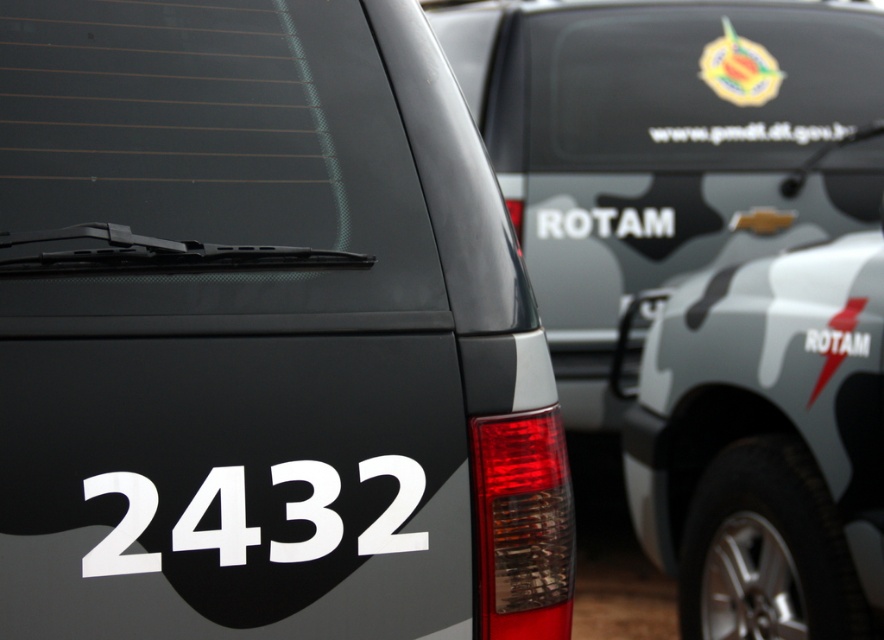
Question: Which point is farther to the camera?

Choices:
 (A) metallic emblem at upper right
 (B) white matte license plate at center

Answer: (A)

Question: Is matte black vehicle at center closer to the viewer compared to white matte text at center?

Choices:
 (A) yes
 (B) no

Answer: (A)

Question: Which point appears closest to the camera in this image?

Choices:
 (A) (215, 108)
 (B) (785, 125)
 (C) (751, 52)
 (D) (630, 307)

Answer: (A)

Question: Is matte black vehicle at center thinner than white matte license plate at center?

Choices:
 (A) no
 (B) yes

Answer: (A)

Question: Among these objects, which one is nearest to the camera?

Choices:
 (A) metallic emblem at upper right
 (B) white matte license plate at center
 (C) white matte text at center

Answer: (B)

Question: Is white matte text at center positioned at the back of white matte license plate at center?

Choices:
 (A) no
 (B) yes

Answer: (B)